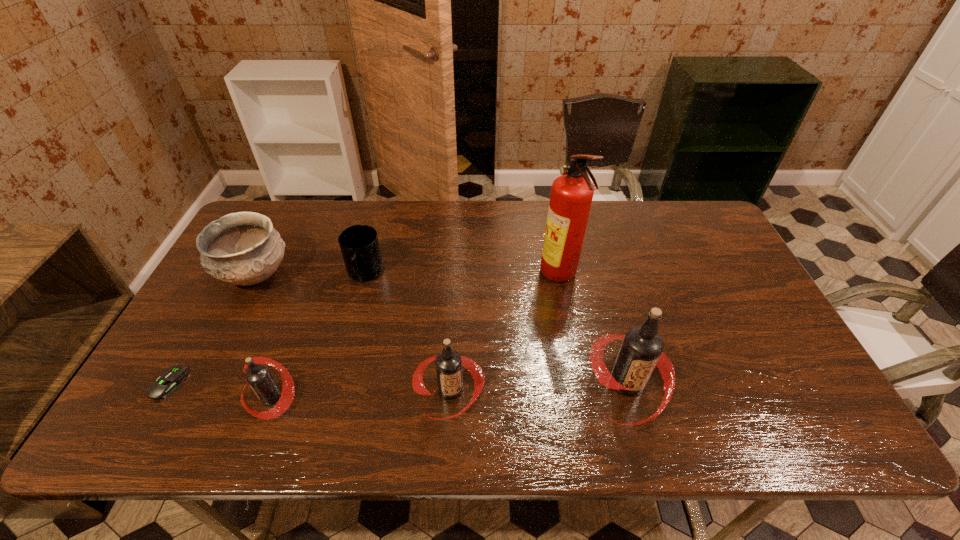
In the current image, all root beers are evenly spaced. To maintain this equal spacing, where should an additional root beer be placed on the right? Please point out a free spot. Please provide its 2D coordinates. Your answer should be formatted as a tuple, i.e. [(x, y)], where the tuple contains the x and y coordinates of a point satisfying the conditions above.

[(801, 377)]